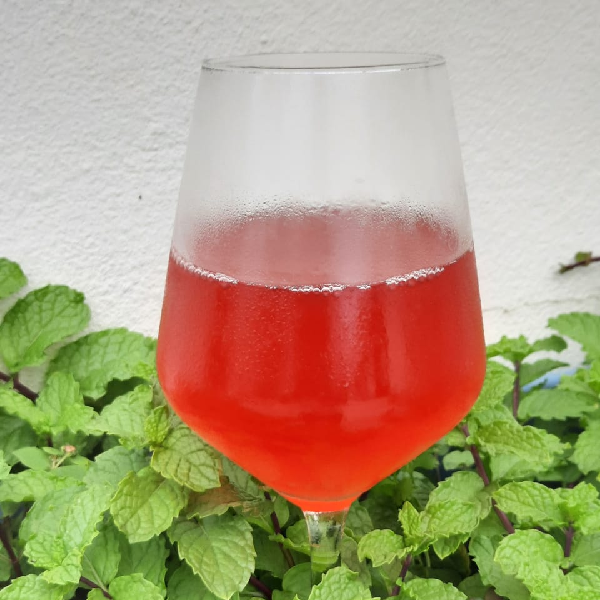
At what (x,y) coordinates should I click in order to perform the action: click on bottom of glass before the stem. Please return your answer as a coordinate pair (x, y). Looking at the image, I should click on (328, 513).